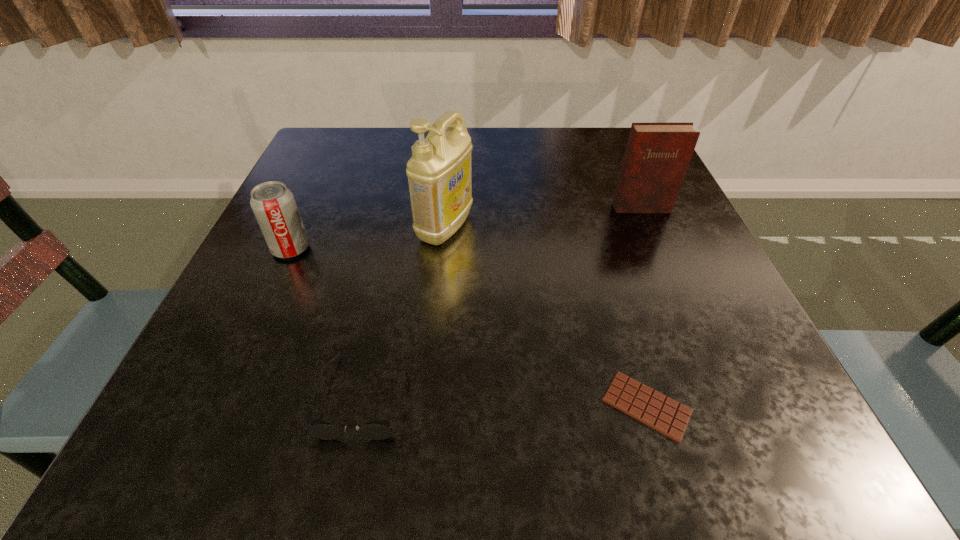
This screenshot has height=540, width=960. What are the coordinates of `the tallest object` in the screenshot? It's located at (439, 172).

Where is `the fourth shortest object`? This screenshot has height=540, width=960. the fourth shortest object is located at coordinates (657, 155).

Find the location of a particular element. The image size is (960, 540). the third shortest object is located at coordinates (273, 204).

Locate an element on the screen. This screenshot has height=540, width=960. soda can is located at coordinates (273, 204).

Locate an element on the screen. the second shortest object is located at coordinates (380, 429).

Locate an element on the screen. candy bar is located at coordinates (660, 412).

This screenshot has height=540, width=960. I want to click on vacant position located on the left of the tallest object, so click(366, 228).

You are a GUI agent. You are given a task and a screenshot of the screen. Output one action in this format:
    pyautogui.click(x=<x>, y=<y>)
    Task: Click on the vacant area situated 0.070m on the front cover of the fourth shortest object
    
    Given the screenshot: What is the action you would take?
    pyautogui.click(x=653, y=235)

In order to click on vacant space located on the right of the soda can in this screenshot , I will do `click(396, 249)`.

Where is `vacant space located on the right of the candy bar`? The height and width of the screenshot is (540, 960). vacant space located on the right of the candy bar is located at coordinates (794, 406).